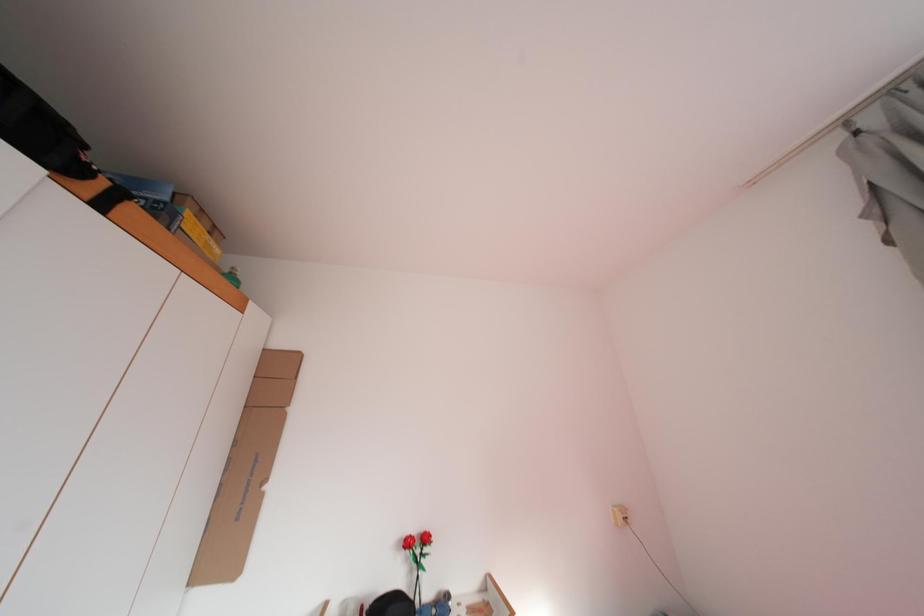
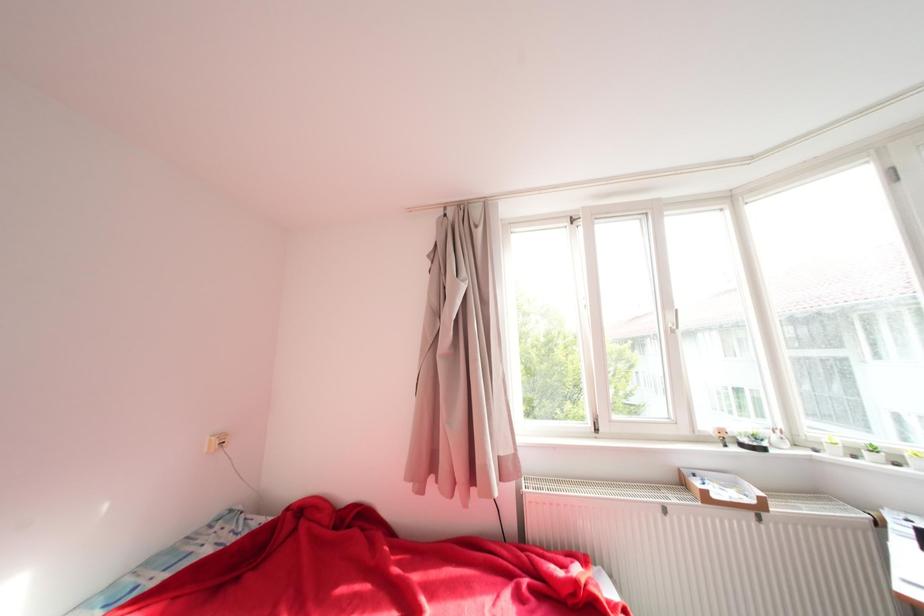
Question: The camera is either moving clockwise (left) or counter-clockwise (right) around the object. The first image is from the beginning of the video and the second image is from the end. Is the camera moving left or right when shooting the video?

Choices:
 (A) Left
 (B) Right

Answer: (A)